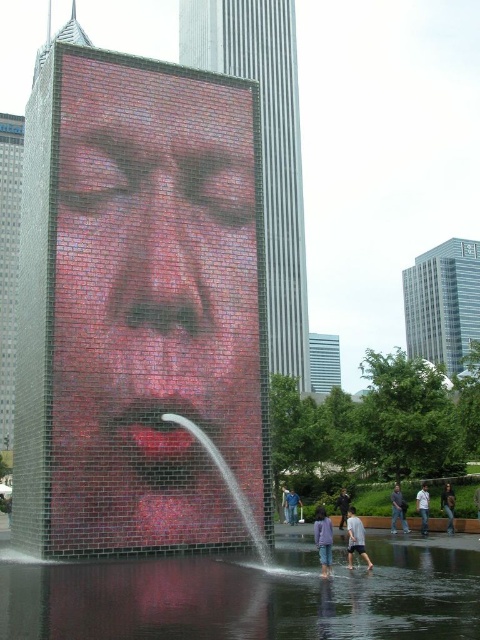
Question: Which point is closer to the camera?

Choices:
 (A) (292, 522)
 (B) (320, 532)
 (C) (352, 509)
 (D) (452, 522)

Answer: (B)

Question: From the image, what is the correct spatial relationship of clear water at center in relation to dark brown leather jacket at lower right?

Choices:
 (A) above
 (B) below

Answer: (A)

Question: Which object is the farthest from the blue denim jeans at lower center?

Choices:
 (A) gray cotton shirt at lower center
 (B) dark gray fabric pants at lower center
 (C) clear water at center
 (D) white cotton shirt at center

Answer: (C)

Question: Considering the relative positions of dark gray fabric pants at lower center and white cotton shirt at center in the image provided, where is dark gray fabric pants at lower center located with respect to white cotton shirt at center?

Choices:
 (A) above
 (B) below

Answer: (A)

Question: Which point is farther to the camera?

Choices:
 (A) blue jeans at lower center
 (B) dark gray fabric jacket at center
 (C) dark gray fabric pants at lower center
 (D) gray cotton shirt at lower center

Answer: (A)

Question: Is clear water at center in front of dark brown leather jacket at lower right?

Choices:
 (A) yes
 (B) no

Answer: (A)